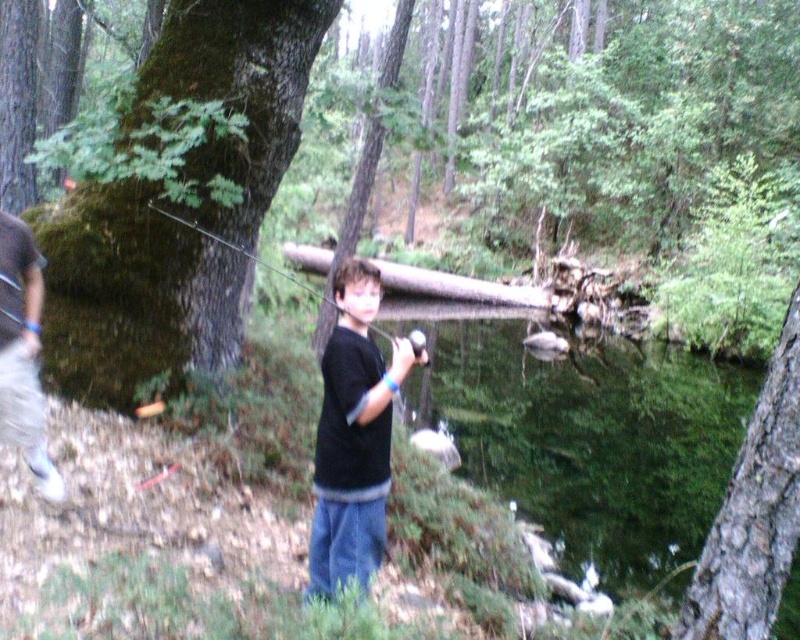
Question: Considering the real-world distances, which object is farthest from the black plastic fishing pole at center?

Choices:
 (A) gray fabric pants at left
 (B) green reflective water at center
 (C) brown wood log at center

Answer: (A)

Question: Which object is farther from the camera taking this photo?

Choices:
 (A) brown wood log at center
 (B) black plastic fishing pole at center
 (C) green mossy tree at left
 (D) black matte shirt at center

Answer: (A)

Question: Is green mossy tree at left positioned at the back of black matte shirt at center?

Choices:
 (A) yes
 (B) no

Answer: (A)

Question: Which point is farther to the camera?

Choices:
 (A) brown wood log at center
 (B) brown rough bark tree at right
 (C) gray fabric pants at left
 (D) green reflective water at center

Answer: (A)

Question: Can you confirm if green reflective water at center is positioned below black matte shirt at center?

Choices:
 (A) no
 (B) yes

Answer: (B)

Question: Can you confirm if green mossy tree at left is positioned to the left of black plastic fishing pole at center?

Choices:
 (A) no
 (B) yes

Answer: (B)